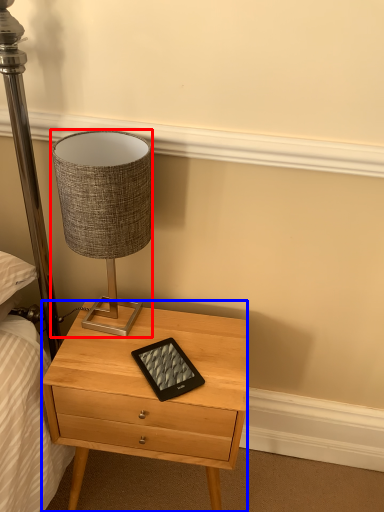
Question: Which object appears closest to the camera in this image, lamp (highlighted by a red box) or nightstand (highlighted by a blue box)?

Choices:
 (A) lamp
 (B) nightstand

Answer: (A)